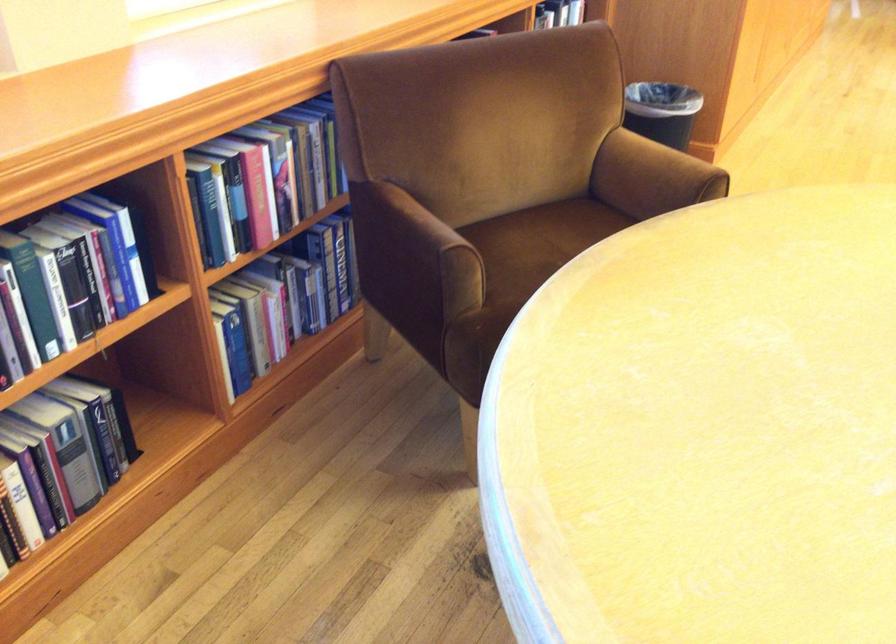
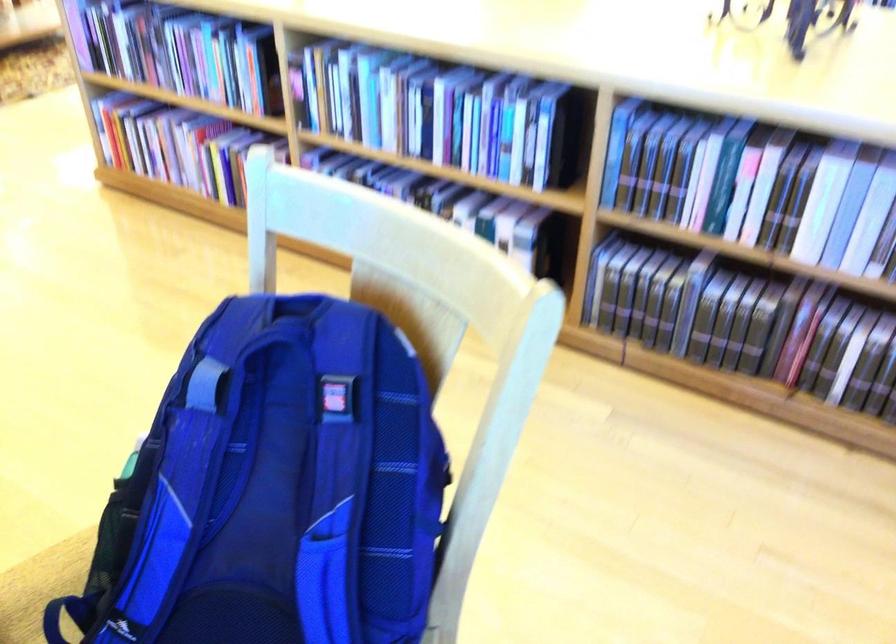
How did the camera likely rotate?

The camera rotated toward right-down.